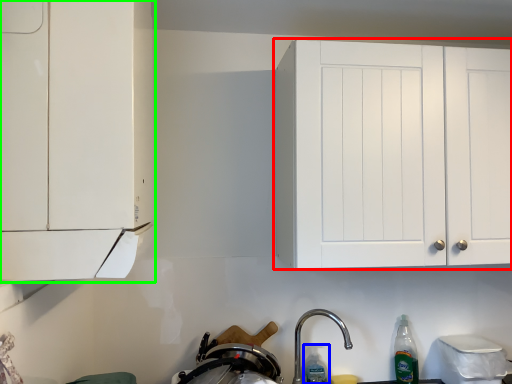
Question: Based on their relative distances, which object is nearer to cabinetry (highlighted by a red box)? Choose from bottle (highlighted by a blue box) and cabinetry (highlighted by a green box).

Choices:
 (A) bottle
 (B) cabinetry

Answer: (B)